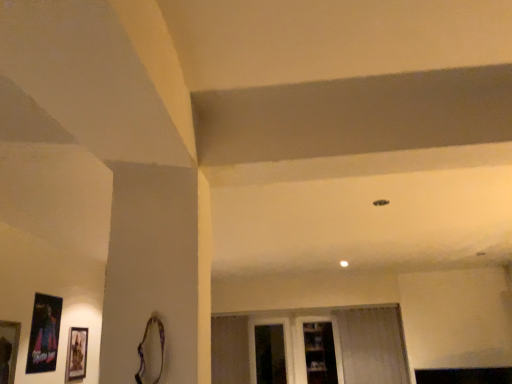
The width and height of the screenshot is (512, 384). I want to click on wooden picture frame at lower left, marked as the first picture frame in a front-to-back arrangement, so click(x=8, y=350).

Describe the element at coordinates (271, 348) in the screenshot. The image size is (512, 384). I see `transparent glass window at center` at that location.

Find the location of `transparent glass window at center`. transparent glass window at center is located at coordinates (271, 348).

At what (x,y) coordinates should I click in order to perform the action: click on transparent glass door at center. Please return your answer as a coordinate pair (x, y). Looking at the image, I should click on (293, 345).

The width and height of the screenshot is (512, 384). Find the location of `white sheer curtain at lower right`. white sheer curtain at lower right is located at coordinates (372, 345).

What is the approximate width of white sheer curtain at lower right?

4.05 inches.

Locate an element on the screen. metallic poster at left, which appears as the second picture frame when viewed from the front is located at coordinates (44, 334).

In the scene shown: Does transparent glass window at center have a larger size compared to transparent glass door at center?

No.

Find the location of a particular element. glass door that is on the right side of transparent glass window at center is located at coordinates (293, 345).

Consider the image. Does transparent glass window at center lie behind transparent glass door at center?

Yes, it is behind transparent glass door at center.

Between wooden picture frame at lower left, the third picture frame in the back-to-front sequence, and clear glass shelves at center, which one appears on the right side from the viewer's perspective?

clear glass shelves at center is more to the right.

Is wooden picture frame at lower left, the third picture frame in the back-to-front sequence, completely or partially outside of clear glass shelves at center?

wooden picture frame at lower left, the third picture frame in the back-to-front sequence, is positioned outside clear glass shelves at center.

From the image's perspective, count 3rd picture frames upward from the clear glass shelves at center and point to it. Please provide its 2D coordinates.

[(8, 350)]

Is wooden picture frame at lower left, marked as the first picture frame in a front-to-back arrangement, positioned with its back to clear glass shelves at center?

That's not correct — wooden picture frame at lower left, marked as the first picture frame in a front-to-back arrangement, is not looking away from clear glass shelves at center.

Considering the relative sizes of transparent glass door at center and matte black picture frame at lower left, which is the third picture frame in front-to-back order, in the image provided, is transparent glass door at center bigger than matte black picture frame at lower left, which is the third picture frame in front-to-back order,?

Yes.

Looking at this image, how many degrees apart are the facing directions of transparent glass door at center and matte black picture frame at lower left, the 1th picture frame in the back-to-front sequence?

transparent glass door at center and matte black picture frame at lower left, the 1th picture frame in the back-to-front sequence, are facing 90 degrees away from each other.

Is transparent glass door at center wider than matte black picture frame at lower left, which is the third picture frame in front-to-back order?

Indeed, transparent glass door at center has a greater width compared to matte black picture frame at lower left, which is the third picture frame in front-to-back order.

Would you say white sheer curtain at lower right is a long distance from wooden picture frame at lower left, the third picture frame in the back-to-front sequence?

Yes.

Is white sheer curtain at lower right not within wooden picture frame at lower left, the third picture frame in the back-to-front sequence?

Indeed, white sheer curtain at lower right is completely outside wooden picture frame at lower left, the third picture frame in the back-to-front sequence.

From a real-world perspective, is white sheer curtain at lower right positioned over wooden picture frame at lower left, the third picture frame in the back-to-front sequence, based on gravity?

Actually, white sheer curtain at lower right is physically below wooden picture frame at lower left, the third picture frame in the back-to-front sequence, in the real world.

From the image's perspective, which object appears higher, white sheer curtain at lower right or wooden picture frame at lower left, marked as the first picture frame in a front-to-back arrangement?

wooden picture frame at lower left, marked as the first picture frame in a front-to-back arrangement, appears higher in the image.

Considering the sizes of objects white sheer curtain at lower right and clear glass shelves at center in the image provided, who is shorter, white sheer curtain at lower right or clear glass shelves at center?

clear glass shelves at center is shorter.

In the image, is white sheer curtain at lower right positioned in front of or behind clear glass shelves at center?

white sheer curtain at lower right is positioned closer to the viewer than clear glass shelves at center.

Between white sheer curtain at lower right and clear glass shelves at center, which one appears on the right side from the viewer's perspective?

white sheer curtain at lower right is more to the right.

Is metallic poster at left, marked as the second picture frame in a back-to-front arrangement, thinner than white sheer curtain at lower right?

Indeed, metallic poster at left, marked as the second picture frame in a back-to-front arrangement, has a lesser width compared to white sheer curtain at lower right.

Which of these two, metallic poster at left, which appears as the second picture frame when viewed from the front, or white sheer curtain at lower right, stands shorter?

metallic poster at left, which appears as the second picture frame when viewed from the front.

From a real-world perspective, is metallic poster at left, marked as the second picture frame in a back-to-front arrangement, located beneath white sheer curtain at lower right?

No.

Which object is positioned more to the right, metallic poster at left, marked as the second picture frame in a back-to-front arrangement, or white sheer curtain at lower right?

white sheer curtain at lower right.

Considering the positions of point (52, 308) and point (254, 325), is point (52, 308) closer or farther from the camera than point (254, 325)?

Point (52, 308) is closer to the camera than point (254, 325).

Is metallic poster at left, marked as the second picture frame in a back-to-front arrangement, directly adjacent to transparent glass door at center?

There is a gap between metallic poster at left, marked as the second picture frame in a back-to-front arrangement, and transparent glass door at center.

Is transparent glass door at center a part of metallic poster at left, marked as the second picture frame in a back-to-front arrangement?

No.

Looking at this image, relative to transparent glass door at center, is metallic poster at left, marked as the second picture frame in a back-to-front arrangement, in front or behind?

Visually, metallic poster at left, marked as the second picture frame in a back-to-front arrangement, is located in front of transparent glass door at center.

Identify the location of glass door that appears on the right of transparent glass window at center. This screenshot has height=384, width=512. (293, 345).

Image resolution: width=512 pixels, height=384 pixels. In the image, there is a wooden picture frame at lower left, the third picture frame in the back-to-front sequence. Identify the location of shelf below it (from the image's perspective). (320, 352).

Which object lies further to the anchor point white sheer curtain at lower right, metallic poster at left, which appears as the second picture frame when viewed from the front, or transparent glass window at center?

The object further to white sheer curtain at lower right is metallic poster at left, which appears as the second picture frame when viewed from the front.

Based on the photo, when comparing their distances from metallic poster at left, marked as the second picture frame in a back-to-front arrangement, does clear glass shelves at center or transparent glass door at center seem closer?

transparent glass door at center lies closer to metallic poster at left, marked as the second picture frame in a back-to-front arrangement, than the other object.

Looking at the image, which one is located closer to transparent glass door at center, matte black picture frame at lower left, which is the third picture frame in front-to-back order, or white sheer curtain at lower right?

white sheer curtain at lower right lies closer to transparent glass door at center than the other object.

From the image, which object appears to be farther from wooden picture frame at lower left, marked as the first picture frame in a front-to-back arrangement, matte black picture frame at lower left, which is the third picture frame in front-to-back order, or clear glass shelves at center?

Among the two, clear glass shelves at center is located further to wooden picture frame at lower left, marked as the first picture frame in a front-to-back arrangement.

Looking at the image, which one is located further to matte black picture frame at lower left, the 1th picture frame in the back-to-front sequence, transparent glass window at center or clear glass shelves at center?

The object further to matte black picture frame at lower left, the 1th picture frame in the back-to-front sequence, is clear glass shelves at center.

In the scene shown: Based on their spatial positions, is transparent glass door at center or clear glass shelves at center closer to white sheer curtain at lower right?

clear glass shelves at center lies closer to white sheer curtain at lower right than the other object.

Which object lies further to the anchor point transparent glass door at center, clear glass shelves at center or metallic poster at left, which appears as the second picture frame when viewed from the front?

metallic poster at left, which appears as the second picture frame when viewed from the front, is positioned further to the anchor transparent glass door at center.

When comparing their distances from matte black picture frame at lower left, the 1th picture frame in the back-to-front sequence, does clear glass shelves at center or wooden picture frame at lower left, marked as the first picture frame in a front-to-back arrangement, seem further?

Among the two, clear glass shelves at center is located further to matte black picture frame at lower left, the 1th picture frame in the back-to-front sequence.

Image resolution: width=512 pixels, height=384 pixels. I want to click on curtain located between wooden picture frame at lower left, the third picture frame in the back-to-front sequence, and transparent glass door at center in the depth direction, so click(x=372, y=345).

Where is `picture frame between metallic poster at left, which appears as the second picture frame when viewed from the front, and transparent glass window at center from front to back`? The height and width of the screenshot is (384, 512). picture frame between metallic poster at left, which appears as the second picture frame when viewed from the front, and transparent glass window at center from front to back is located at coordinates (76, 354).

The height and width of the screenshot is (384, 512). Identify the location of shelf between transparent glass door at center and white sheer curtain at lower right in the horizontal direction. point(320,352).

Locate an element on the screen. glass door positioned between wooden picture frame at lower left, the third picture frame in the back-to-front sequence, and transparent glass window at center from near to far is located at coordinates pos(293,345).